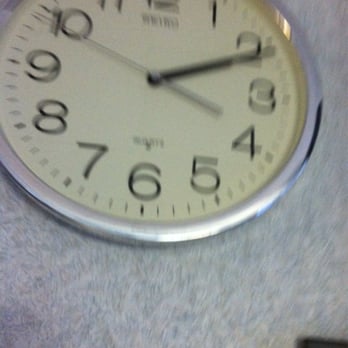
Find the location of a particular element. The height and width of the screenshot is (348, 348). silver frame is located at coordinates (49, 196), (189, 234), (292, 164).